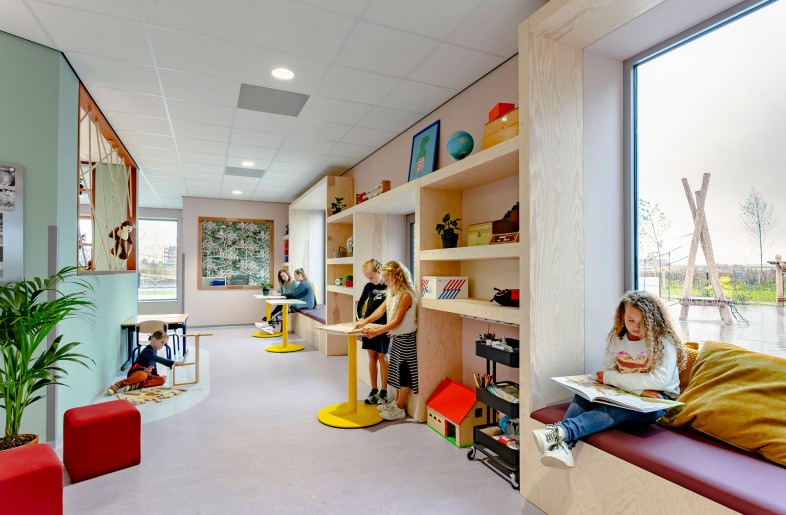
Identify the location of shelf. (479, 166).